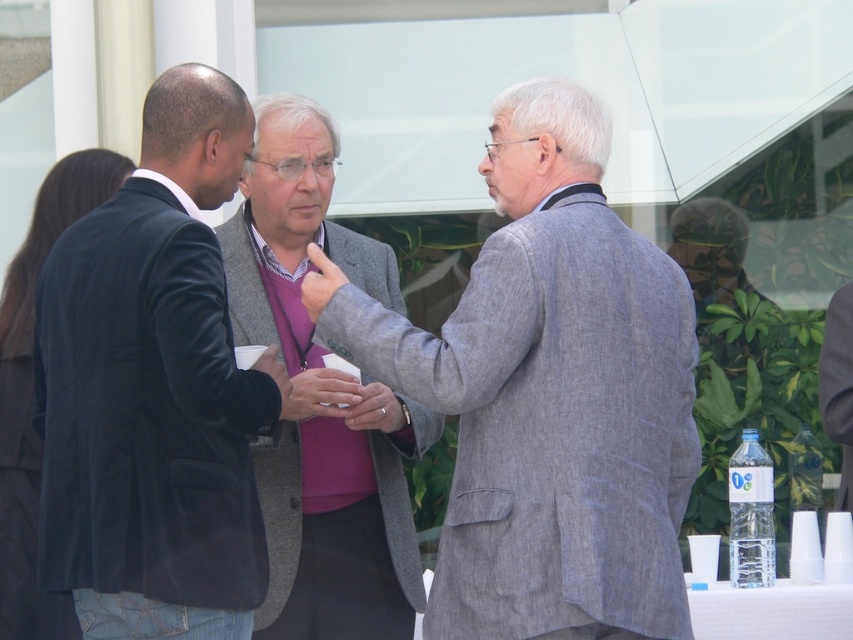
Based on the photo, between velvet black blazer at left and gray woolen blazer at center, which one appears on the right side from the viewer's perspective?

Positioned to the right is gray woolen blazer at center.

Is point (83, 400) less distant than point (271, 572)?

Yes, point (83, 400) is in front of point (271, 572).

The height and width of the screenshot is (640, 853). In order to click on velvet black blazer at left in this screenshot , I will do pos(154,388).

Is gray woolen blazer at center to the right of matte gray hand at center from the viewer's perspective?

Incorrect, gray woolen blazer at center is not on the right side of matte gray hand at center.

Does gray woolen blazer at center appear over matte gray hand at center?

Yes, gray woolen blazer at center is above matte gray hand at center.

Is point (289, 556) positioned after point (387, 432)?

No, it is in front of (387, 432).

Find the location of a particular element. The width and height of the screenshot is (853, 640). gray woolen blazer at center is located at coordinates tap(340, 529).

Who is taller, gray textured suit at center or matte gray hand at center?

Result: gray textured suit at center

Does gray textured suit at center have a greater height compared to matte gray hand at center?

Correct, gray textured suit at center is much taller as matte gray hand at center.

You are a GUI agent. You are given a task and a screenshot of the screen. Output one action in this format:
    pyautogui.click(x=<x>, y=<y>)
    Task: Click on the gray textured suit at center
    This screenshot has width=853, height=640.
    Given the screenshot: What is the action you would take?
    pyautogui.click(x=550, y=396)